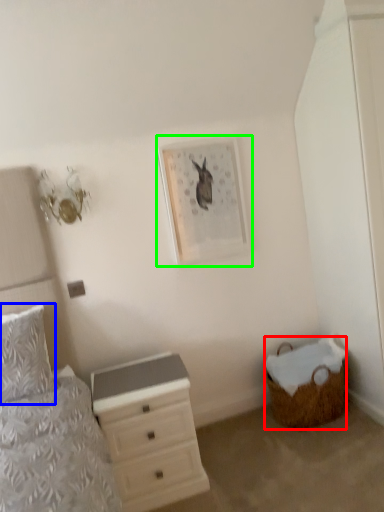
Question: Which object is positioned closest to basket (highlighted by a red box)? Select from pillow (highlighted by a blue box) and picture frame (highlighted by a green box).

Choices:
 (A) pillow
 (B) picture frame

Answer: (B)